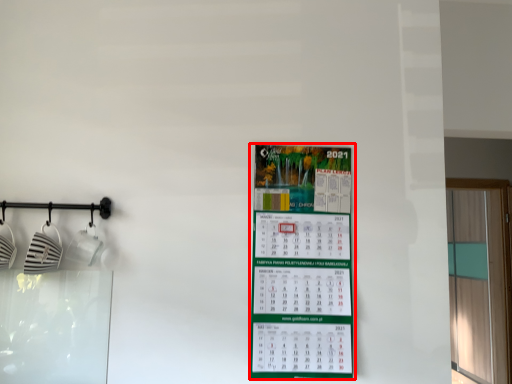
Question: Observing the image, what is the correct spatial positioning of poster (annotated by the red box) in reference to window?

Choices:
 (A) left
 (B) right

Answer: (A)